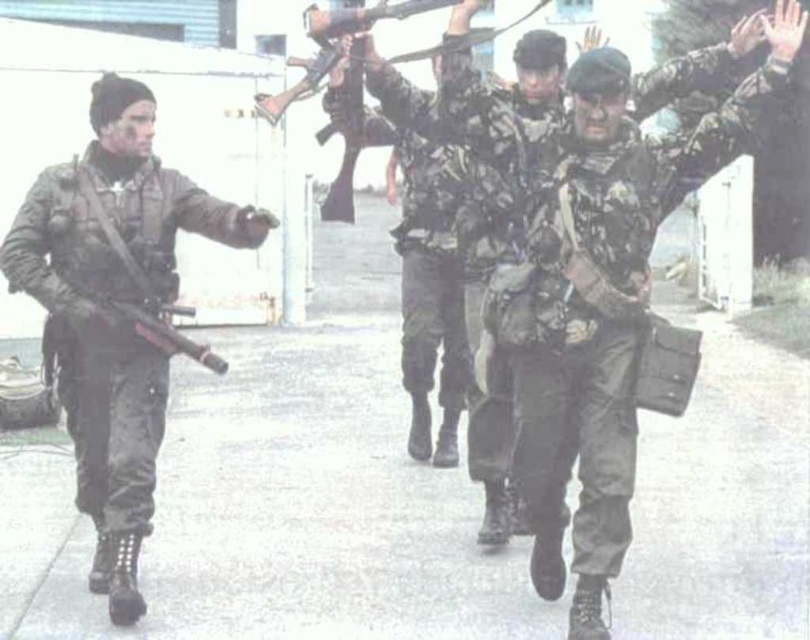
Question: Considering the relative positions of camouflage uniform at left and camouflage fabric uniform at center in the image provided, where is camouflage uniform at left located with respect to camouflage fabric uniform at center?

Choices:
 (A) right
 (B) left

Answer: (B)

Question: Which point appears closest to the camera in this image?

Choices:
 (A) (50, 314)
 (B) (617, 401)

Answer: (B)

Question: Which point is farther to the camera?

Choices:
 (A) (67, 348)
 (B) (637, 216)

Answer: (A)

Question: Can you confirm if camouflage uniform at left is positioned below camouflage fabric uniform at center?

Choices:
 (A) yes
 (B) no

Answer: (A)

Question: Does camouflage uniform at left have a larger size compared to camouflage fabric uniform at center?

Choices:
 (A) yes
 (B) no

Answer: (A)

Question: Which object appears closest to the camera in this image?

Choices:
 (A) camouflage uniform at left
 (B) camouflage fabric uniform at center

Answer: (B)